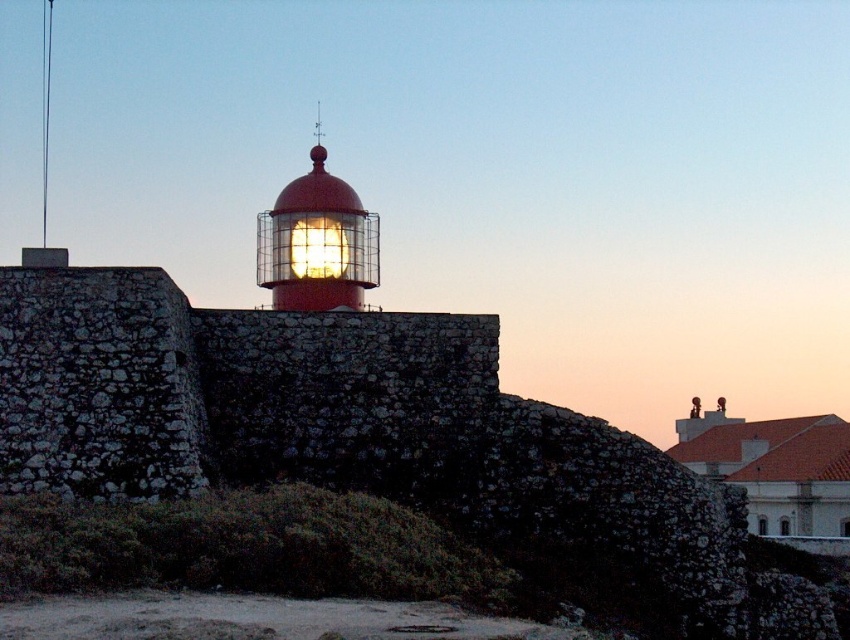
Question: Which object is farther from the camera taking this photo?

Choices:
 (A) matte glass lighthouse at center
 (B) matte red lighthouse at center

Answer: (A)

Question: Can you confirm if matte red lighthouse at center is thinner than matte glass lighthouse at center?

Choices:
 (A) no
 (B) yes

Answer: (A)

Question: Among these points, which one is nearest to the camera?

Choices:
 (A) (366, 252)
 (B) (341, 266)

Answer: (B)

Question: Is matte red lighthouse at center smaller than matte glass lighthouse at center?

Choices:
 (A) no
 (B) yes

Answer: (A)

Question: Does matte red lighthouse at center have a larger size compared to matte glass lighthouse at center?

Choices:
 (A) no
 (B) yes

Answer: (B)